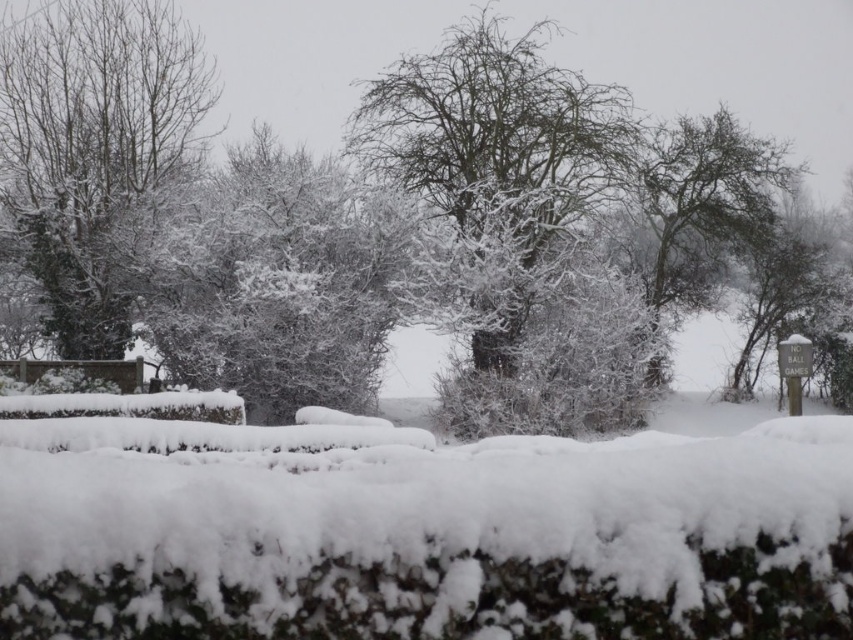
You are standing in the winter scene and want to take a photo of both point (595, 600) and point (409, 141). Which point will appear larger in your camera view?

Point (595, 600) is closer to the camera than point (409, 141), so it will appear larger in the camera view.

You are standing in the winter scene and want to place a small snowman exactly at the center of the image. Is the white fluffy hedge at center in the way?

The white fluffy hedge at center is located at point (421,531), which is not the exact center of the image. Therefore, placing a snowman at the center would not interfere with the hedge.